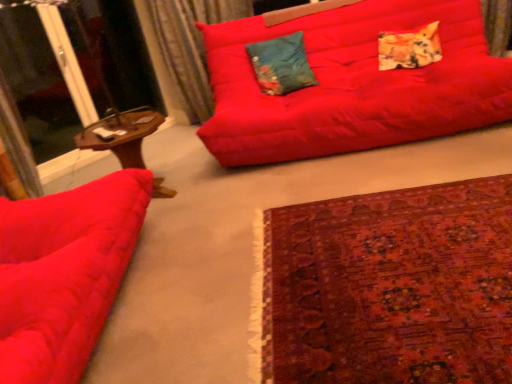
Image resolution: width=512 pixels, height=384 pixels. Find the location of `vacant area that lies to the right of woodenwoodentable at left`. vacant area that lies to the right of woodenwoodentable at left is located at coordinates (215, 184).